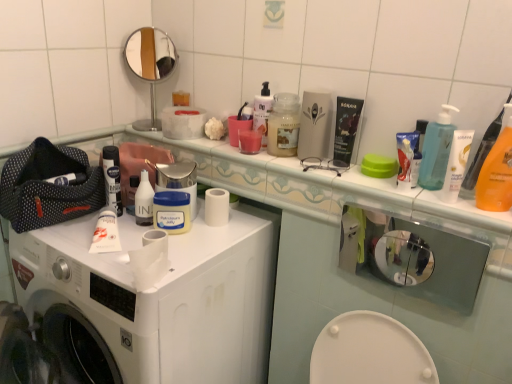
Find the location of `vacant space that is to the left of black matte tube at upper center, the second product positioned from the front`. vacant space that is to the left of black matte tube at upper center, the second product positioned from the front is located at coordinates (294, 165).